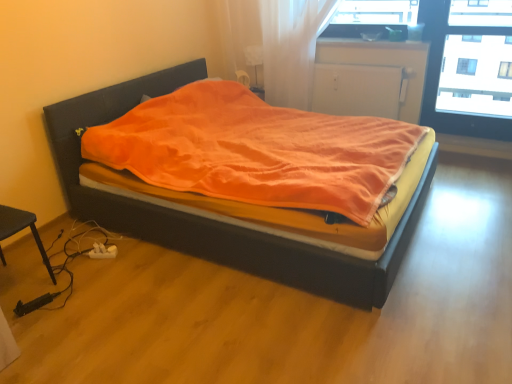
Looking at this image, what is the approximate width of velvet orange blanket at center?

It is 2.12 meters.

What do you see at coordinates (476, 76) in the screenshot? The height and width of the screenshot is (384, 512). I see `transparent glass window at upper right` at bounding box center [476, 76].

Find the location of `smooth wood window sill at right`. smooth wood window sill at right is located at coordinates (475, 146).

From the image's perspective, between smooth wood window sill at right and transparent glass window at upper right, which one is located above?

transparent glass window at upper right is shown above in the image.

Find the location of a particular element. This screenshot has height=384, width=512. window screen that is above the smooth wood window sill at right (from the image's perspective) is located at coordinates (476, 76).

Consider the image. Would you say smooth wood window sill at right is a long distance from transparent glass window at upper right?

smooth wood window sill at right is near transparent glass window at upper right, not far away.

How many degrees apart are the facing directions of transparent glass window at upper right and velvet orange blanket at center?

The angular difference between transparent glass window at upper right and velvet orange blanket at center is 90 degrees.

Is transparent glass window at upper right next to velvet orange blanket at center?

transparent glass window at upper right and velvet orange blanket at center are clearly separated.

Looking at this image, can you confirm if transparent glass window at upper right is positioned to the left of velvet orange blanket at center?

Incorrect, transparent glass window at upper right is not on the left side of velvet orange blanket at center.

From the image's perspective, is transparent glass window at upper right located beneath velvet orange blanket at center?

No, from the image's perspective, transparent glass window at upper right is not beneath velvet orange blanket at center.

Which object is positioned more to the right, white matte radiator at upper center or smooth wood window sill at right?

smooth wood window sill at right.

Between white matte radiator at upper center and smooth wood window sill at right, which one has less height?

smooth wood window sill at right.

Is white matte radiator at upper center looking in the opposite direction of smooth wood window sill at right?

Answer: That's not correct — white matte radiator at upper center is not looking away from smooth wood window sill at right.

Based on the photo, does white matte radiator at upper center have a larger size compared to smooth wood window sill at right?

Correct, white matte radiator at upper center is larger in size than smooth wood window sill at right.

Do you think transparent glass window at upper right is within smooth wood window sill at right, or outside of it?

The correct answer is: outside.

Based on the photo, is transparent glass window at upper right positioned in front of smooth wood window sill at right?

That is True.

From the image's perspective, would you say transparent glass window at upper right is positioned over smooth wood window sill at right?

Yes, from the image's perspective, transparent glass window at upper right is on top of smooth wood window sill at right.

The image size is (512, 384). Identify the location of window sill below the transparent glass window at upper right (from a real-world perspective). (475, 146).

Is the depth of smooth wood window sill at right less than that of white matte radiator at upper center?

No, it is behind white matte radiator at upper center.

Is smooth wood window sill at right taller than white matte radiator at upper center?

Incorrect, the height of smooth wood window sill at right is not larger of that of white matte radiator at upper center.

Is point (438, 138) positioned after point (351, 96)?

That is False.

Is smooth wood window sill at right to the right of velvet orange blanket at center from the viewer's perspective?

Yes, smooth wood window sill at right is to the right of velvet orange blanket at center.

Considering the positions of points (457, 152) and (275, 242), is point (457, 152) farther from camera compared to point (275, 242)?

Yes, point (457, 152) is behind point (275, 242).

From the image's perspective, who appears lower, smooth wood window sill at right or velvet orange blanket at center?

velvet orange blanket at center is shown below in the image.

Is smooth wood window sill at right aimed at velvet orange blanket at center?

No, smooth wood window sill at right does not turn towards velvet orange blanket at center.

Does white matte radiator at upper center have a larger size compared to transparent glass window at upper right?

No, white matte radiator at upper center is not bigger than transparent glass window at upper right.

Are white matte radiator at upper center and transparent glass window at upper right far apart?

They are positioned close to each other.

From a real-world perspective, between white matte radiator at upper center and transparent glass window at upper right, who is vertically lower?

white matte radiator at upper center is physically lower.

Does point (323, 84) lie behind point (502, 80)?

No, (323, 84) is in front of (502, 80).

The height and width of the screenshot is (384, 512). Find the location of `window sill that appears behind the transparent glass window at upper right`. window sill that appears behind the transparent glass window at upper right is located at coordinates (475, 146).

In the image, there is a velvet orange blanket at center. At what (x,y) coordinates should I click in order to perform the action: click on window screen above it (from the image's perspective). Please return your answer as a coordinate pair (x, y). This screenshot has width=512, height=384. Looking at the image, I should click on (476, 76).

Looking at the image, which one is located further to white matte radiator at upper center, velvet orange blanket at center or smooth wood window sill at right?

The object further to white matte radiator at upper center is velvet orange blanket at center.

When comparing their distances from velvet orange blanket at center, does transparent glass window at upper right or white matte radiator at upper center seem further?

transparent glass window at upper right lies further to velvet orange blanket at center than the other object.

Looking at this image, considering their positions, is smooth wood window sill at right positioned further to velvet orange blanket at center than white matte radiator at upper center?

Among the two, smooth wood window sill at right is located further to velvet orange blanket at center.

Considering their positions, is velvet orange blanket at center positioned further to white matte radiator at upper center than transparent glass window at upper right?

Based on the image, velvet orange blanket at center appears to be further to white matte radiator at upper center.

Considering their positions, is velvet orange blanket at center positioned closer to transparent glass window at upper right than white matte radiator at upper center?

white matte radiator at upper center is closer to transparent glass window at upper right.

When comparing their distances from velvet orange blanket at center, does transparent glass window at upper right or smooth wood window sill at right seem further?

The object further to velvet orange blanket at center is transparent glass window at upper right.

Which object lies nearer to the anchor point white matte radiator at upper center, transparent glass window at upper right or smooth wood window sill at right?

Among the two, smooth wood window sill at right is located nearer to white matte radiator at upper center.

Based on their spatial positions, is white matte radiator at upper center or smooth wood window sill at right closer to transparent glass window at upper right?

smooth wood window sill at right.

Locate an element on the screen. The image size is (512, 384). screen door located between velvet orange blanket at center and smooth wood window sill at right in the depth direction is located at coordinates (357, 90).

What are the coordinates of `window screen between velvet orange blanket at center and smooth wood window sill at right in the horizontal direction` in the screenshot? It's located at (476, 76).

I want to click on window screen between velvet orange blanket at center and white matte radiator at upper center along the z-axis, so click(476, 76).

Identify the location of window screen between white matte radiator at upper center and smooth wood window sill at right. pyautogui.click(x=476, y=76).